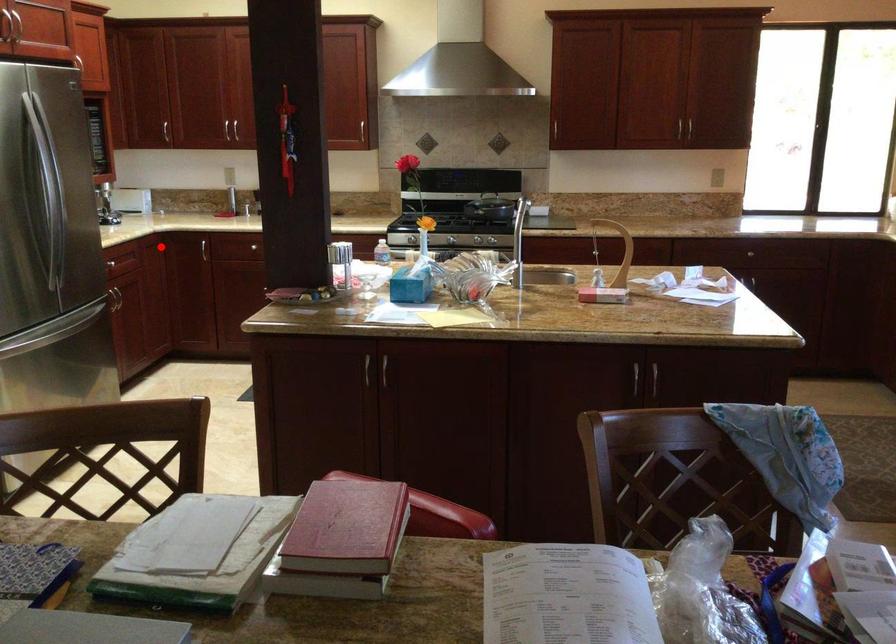
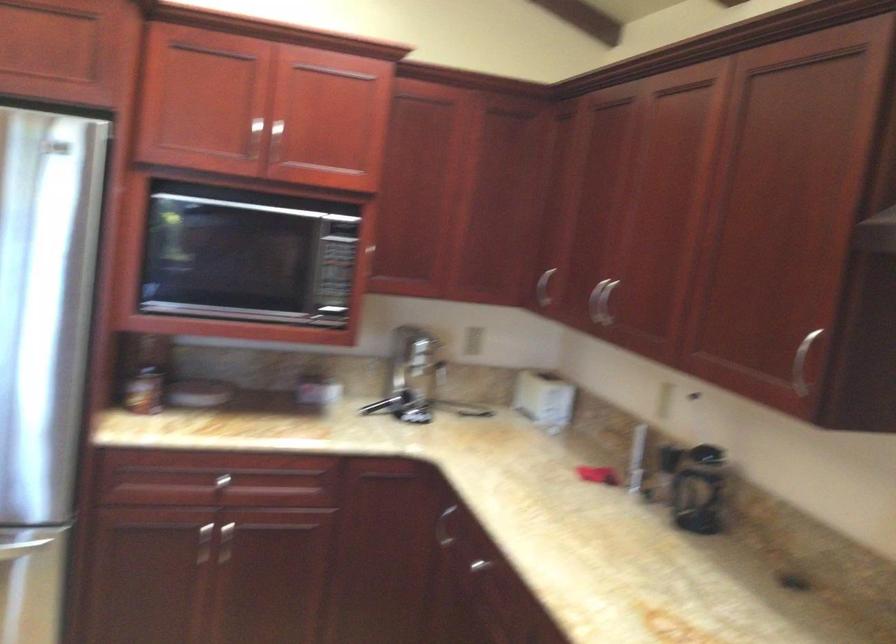
Question: I am providing you with two images of the same scene from different viewpoints. A red point is shown in image1. For the corresponding object point in image2, is it positioned nearer or farther from the camera?

Choices:
 (A) Nearer
 (B) Farther

Answer: (A)